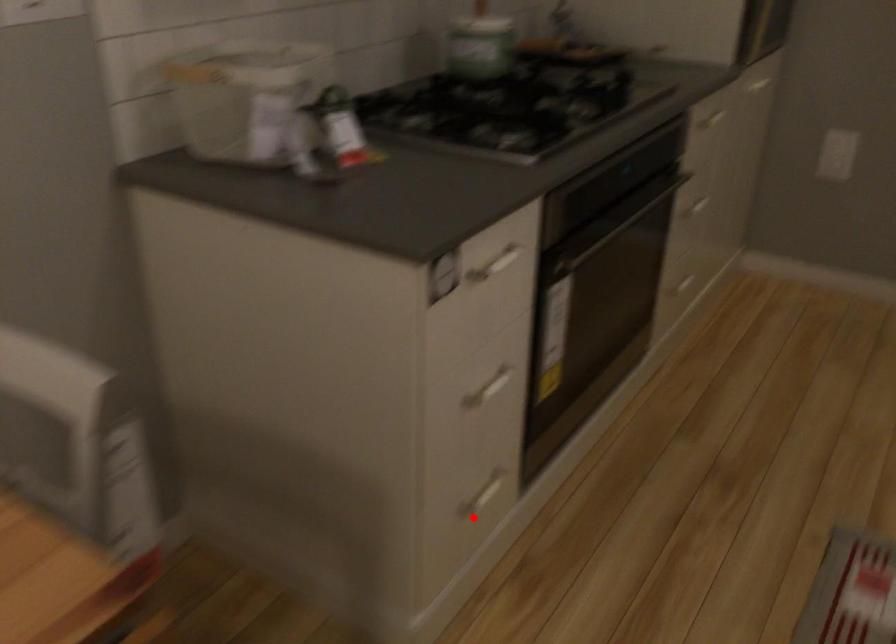
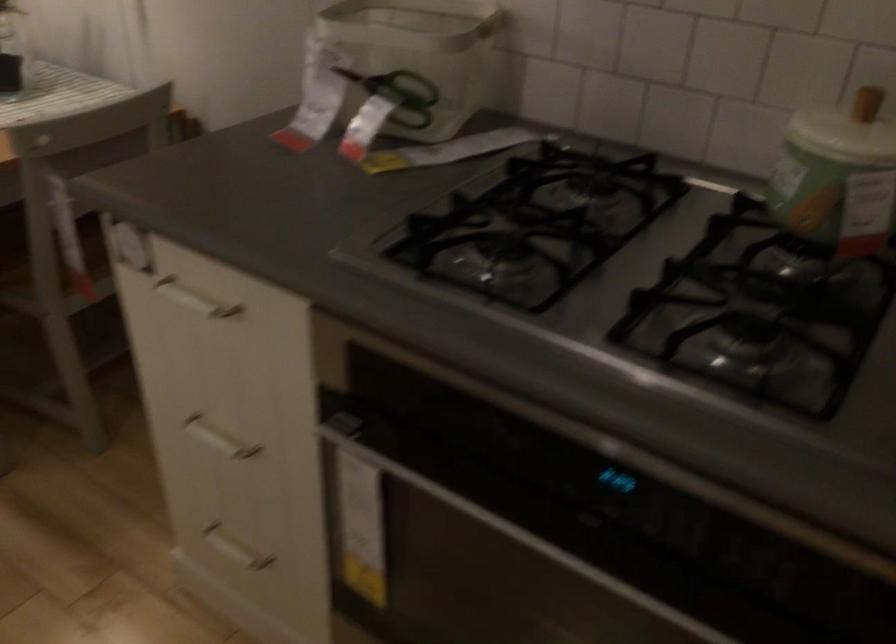
Where in the second image is the point corresponding to the highlighted location from the first image?

(234, 549)